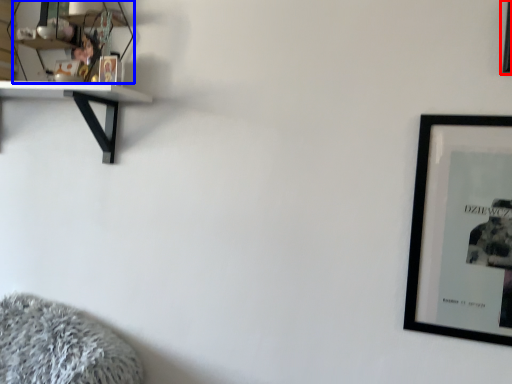
Question: Which of the following is the farthest to the observer, picture frame (highlighted by a red box) or shelf (highlighted by a blue box)?

Choices:
 (A) picture frame
 (B) shelf

Answer: (B)